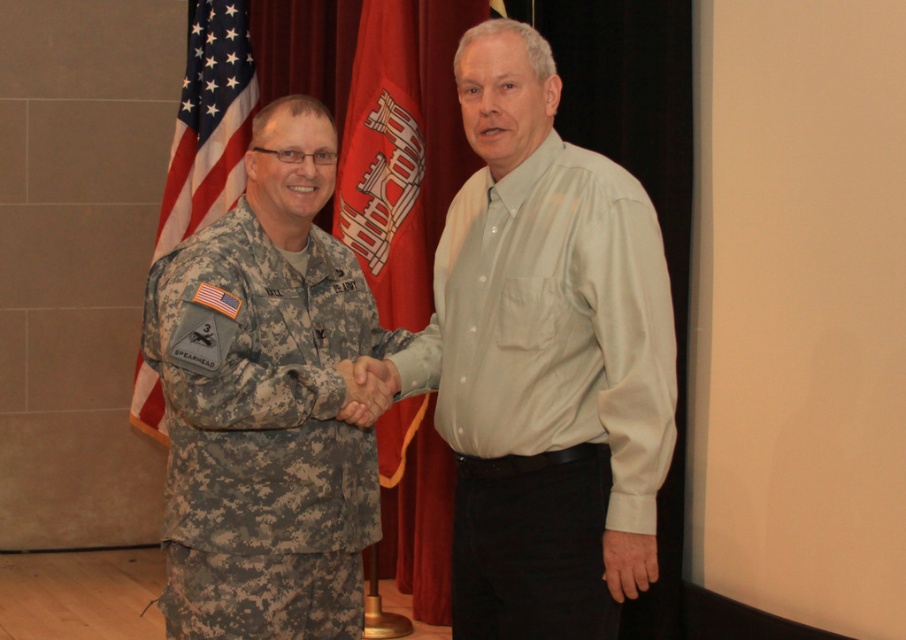
You are a photographer positioned at the back of the scene. You need to capture a photo where both the camouflage fabric uniform at left and the american flag at left are fully visible in the frame. Based on their positions, do you think adjusting the camera angle to the right might help include both subjects?

The camouflage fabric uniform at left might be wider than the american flag at left, so adjusting the camera angle to the right could help ensure both are fully visible in the frame.

You are a photographer standing at the back of the scene. You need to capture a photo where both the red fabric flag at center and the american flag at left are visible in the frame. Given that your camera has a maximum horizontal field of view of 36 inches, will you be able to fit both flags into the photo?

The red fabric flag at center and the american flag at left are 36.23 inches apart from each other. Since the distance between them exceeds the camera field of view by 0.23 inches, the flags cannot both be captured in a single frame.

You are a photographer positioned behind the two people shaking hands. You want to take a photo that clearly shows both the light gray cotton shirt at right and the red fabric flag at center. Which object will appear larger in your photo?

The light gray cotton shirt at right is closer to the viewer than the red fabric flag at center, so it will appear larger in the photo.